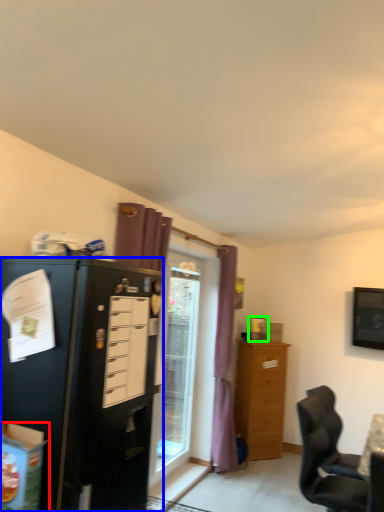
Question: Which object is the farthest from box (highlighted by a red box)? Choose among these: cabinetry (highlighted by a blue box) or picture frame (highlighted by a green box).

Choices:
 (A) cabinetry
 (B) picture frame

Answer: (B)